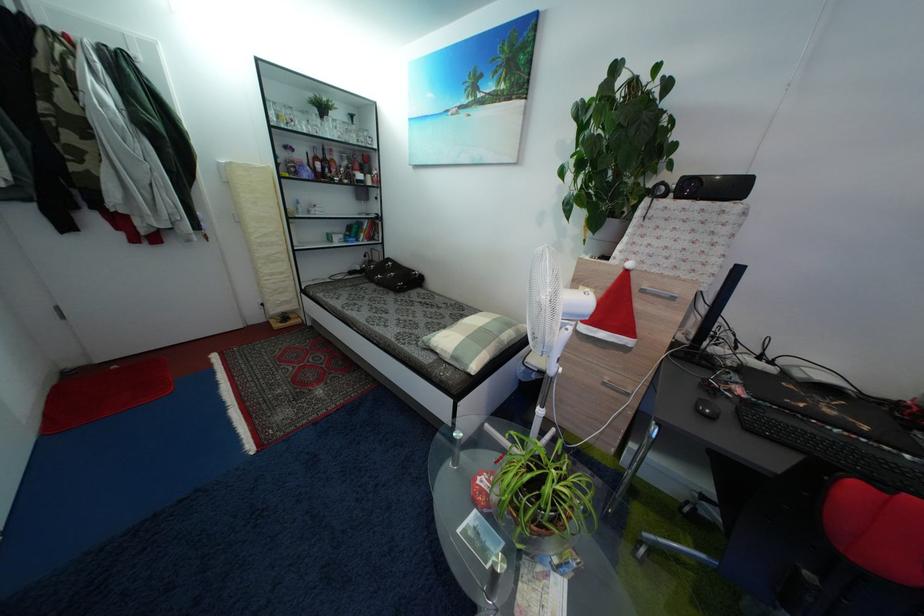
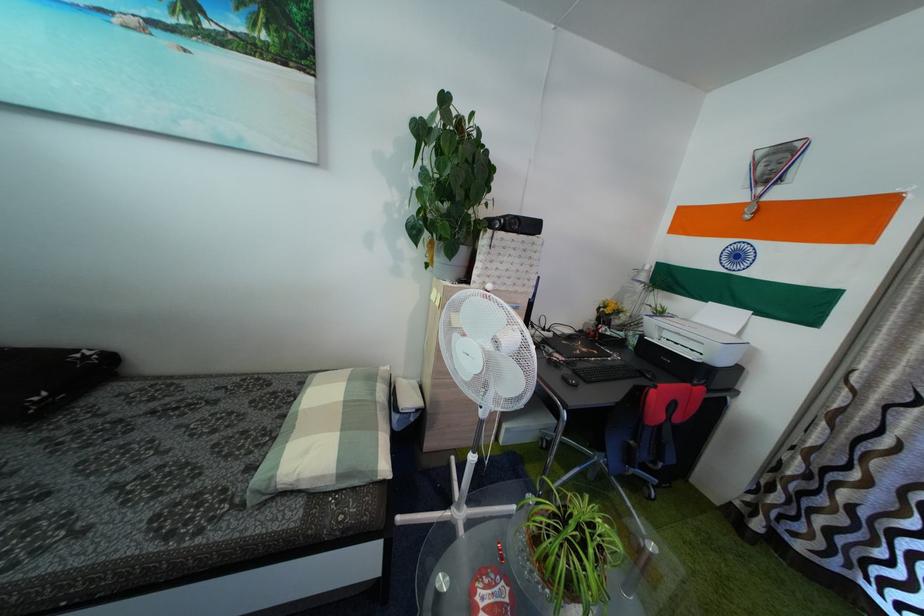
The point at (735, 413) is marked in the first image. Where is the corresponding point in the second image?

(575, 379)